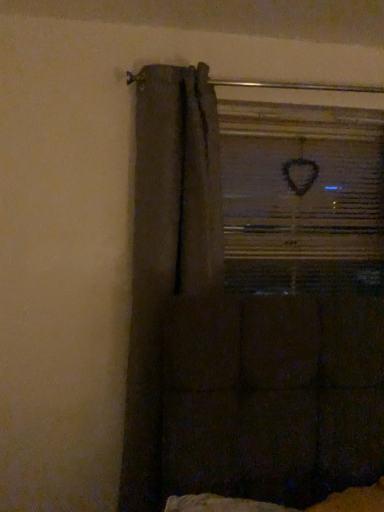
Question: Can you confirm if dark fabric curtain at left is bigger than clear glass window at upper center?

Choices:
 (A) no
 (B) yes

Answer: (B)

Question: From a real-world perspective, is dark fabric curtain at left physically above clear glass window at upper center?

Choices:
 (A) yes
 (B) no

Answer: (B)

Question: Can you confirm if dark fabric curtain at left is thinner than clear glass window at upper center?

Choices:
 (A) yes
 (B) no

Answer: (B)

Question: Could clear glass window at upper center be considered to be inside dark fabric curtain at left?

Choices:
 (A) no
 (B) yes

Answer: (A)

Question: From the image's perspective, is dark fabric curtain at left under clear glass window at upper center?

Choices:
 (A) no
 (B) yes

Answer: (B)

Question: From the image's perspective, is dark fabric curtain at left over clear glass window at upper center?

Choices:
 (A) yes
 (B) no

Answer: (B)

Question: Is clear glass window at upper center aimed at dark fabric curtain at left?

Choices:
 (A) no
 (B) yes

Answer: (A)

Question: Does clear glass window at upper center have a greater height compared to dark fabric curtain at left?

Choices:
 (A) yes
 (B) no

Answer: (B)

Question: Does clear glass window at upper center have a lesser width compared to dark fabric curtain at left?

Choices:
 (A) yes
 (B) no

Answer: (A)

Question: Is the surface of clear glass window at upper center in direct contact with dark fabric curtain at left?

Choices:
 (A) no
 (B) yes

Answer: (A)

Question: Considering the relative positions of clear glass window at upper center and dark fabric curtain at left in the image provided, is clear glass window at upper center to the left of dark fabric curtain at left from the viewer's perspective?

Choices:
 (A) yes
 (B) no

Answer: (B)

Question: Can you confirm if clear glass window at upper center is smaller than dark fabric curtain at left?

Choices:
 (A) yes
 (B) no

Answer: (A)

Question: Is dark fabric curtain at left to the left or to the right of clear glass window at upper center in the image?

Choices:
 (A) left
 (B) right

Answer: (A)